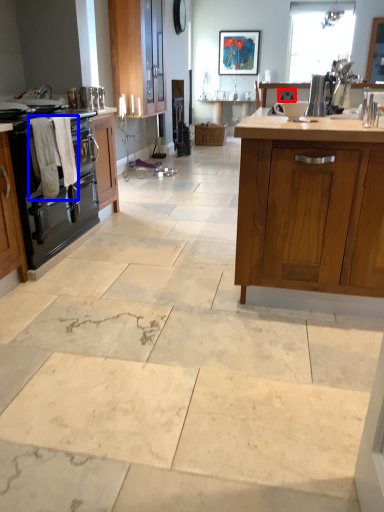
Question: Which of the following is the closest to the observer, appliance (highlighted by a red box) or laundry (highlighted by a blue box)?

Choices:
 (A) appliance
 (B) laundry

Answer: (B)